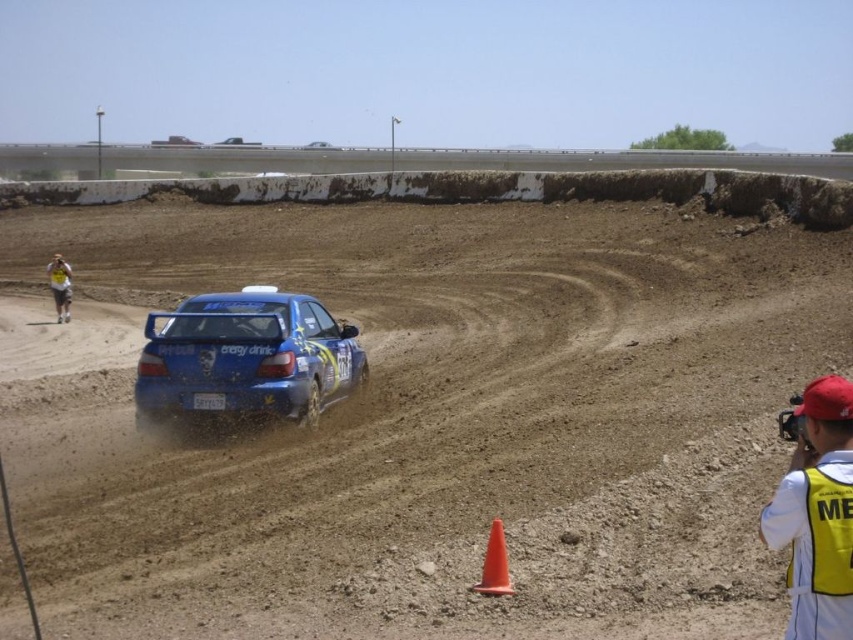
Question: Is orange matte/cone at lower center further to camera compared to yellow/yellowish fabric safety vest at left?

Choices:
 (A) yes
 (B) no

Answer: (B)

Question: Which object appears closest to the camera in this image?

Choices:
 (A) blue glossy rally car at center
 (B) dusty brown dirt at center
 (C) yellow fabric safety vest at lower right

Answer: (C)

Question: Which is farther from the blue glossy rally car at center?

Choices:
 (A) yellow/yellowish fabric safety vest at left
 (B) yellow fabric safety vest at lower right
 (C) orange matte/cone at lower center

Answer: (A)

Question: Can you confirm if yellow shirt at left is positioned to the right of yellow/yellowish fabric safety vest at left?

Choices:
 (A) no
 (B) yes

Answer: (A)

Question: Which of the following is the closest to the observer?

Choices:
 (A) (206, 328)
 (B) (51, 284)

Answer: (A)

Question: Can you confirm if brown dirt at upper center is positioned to the right of yellow/yellowish fabric safety vest at left?

Choices:
 (A) no
 (B) yes

Answer: (B)